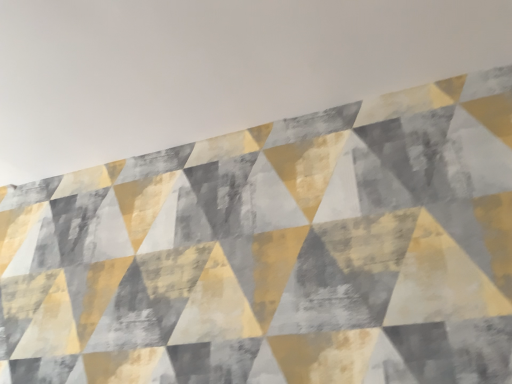
Locate an element on the screen. The width and height of the screenshot is (512, 384). textured paper at upper center is located at coordinates (212, 68).

This screenshot has width=512, height=384. What do you see at coordinates (212, 68) in the screenshot? I see `textured paper at upper center` at bounding box center [212, 68].

Find the location of a particular element. This screenshot has width=512, height=384. textured paper at upper center is located at coordinates (212, 68).